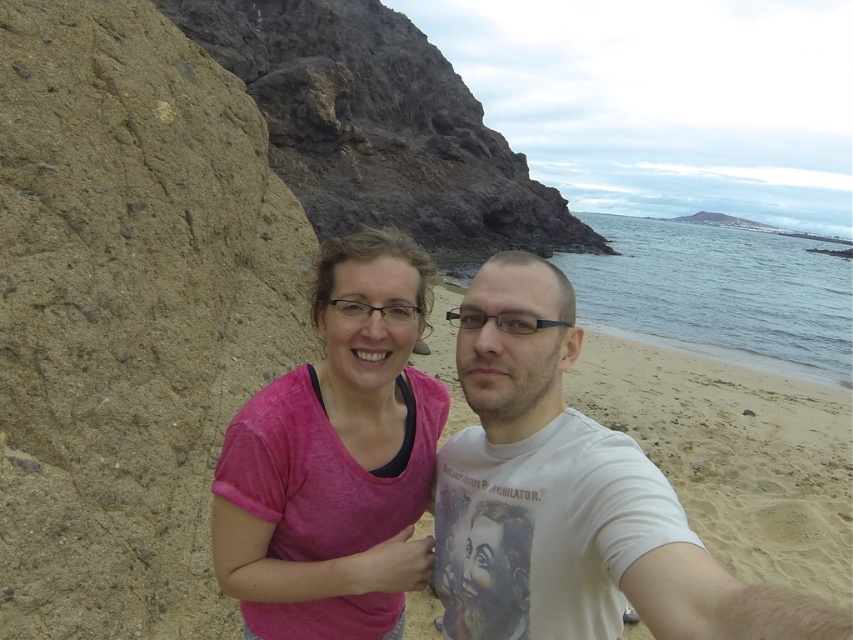
Can you confirm if pink fabric at center is shorter than brown rough rock at upper left?

Yes.

Does pink fabric at center have a smaller size compared to brown rough rock at upper left?

Yes, pink fabric at center is smaller than brown rough rock at upper left.

Is point (352, 451) positioned behind point (469, 220)?

That is False.

The height and width of the screenshot is (640, 853). In order to click on pink fabric at center in this screenshot , I will do `click(335, 458)`.

Is white cotton t-shirt at center smaller than pink fabric at center?

Correct, white cotton t-shirt at center occupies less space than pink fabric at center.

Is white cotton t-shirt at center positioned in front of pink fabric at center?

Yes, white cotton t-shirt at center is in front of pink fabric at center.

This screenshot has width=853, height=640. Describe the element at coordinates (570, 497) in the screenshot. I see `white cotton t-shirt at center` at that location.

Where is `white cotton t-shirt at center`? white cotton t-shirt at center is located at coordinates (570, 497).

Identify the location of white cotton t-shirt at center. The height and width of the screenshot is (640, 853). (570, 497).

Consider the image. Between white cotton t-shirt at center and brown rough rock at upper left, which one appears on the left side from the viewer's perspective?

Positioned to the left is brown rough rock at upper left.

Describe the element at coordinates (570, 497) in the screenshot. I see `white cotton t-shirt at center` at that location.

What are the coordinates of `white cotton t-shirt at center` in the screenshot? It's located at (570, 497).